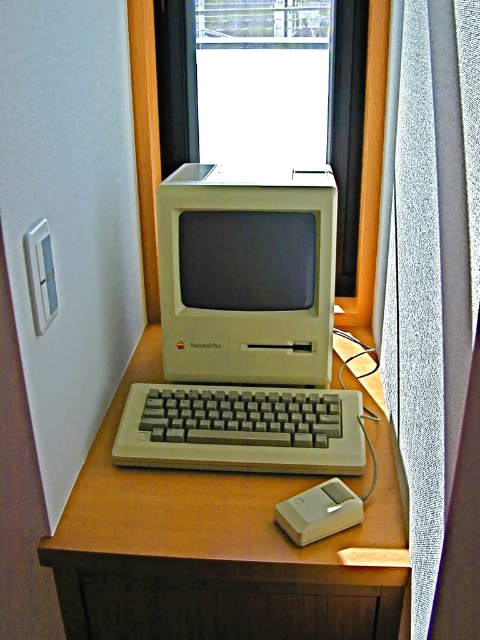
Which of these two, transparent glass window at center or white plastic computer monitor at center, stands shorter?

white plastic computer monitor at center is shorter.

Is point (311, 80) positioned behind point (259, 356)?

Yes, it is.

Is point (177, 116) more distant than point (331, 250)?

Yes.

This screenshot has height=640, width=480. Find the location of `transparent glass window at center`. transparent glass window at center is located at coordinates (267, 92).

Is wooden at center shorter than white plastic computer monitor at center?

Incorrect, wooden at center's height does not fall short of white plastic computer monitor at center's.

Between point (100, 497) and point (287, 216), which one is positioned behind?

Point (287, 216)

Between point (222, 592) and point (228, 269), which one is positioned in front?

Point (222, 592) is in front.

This screenshot has height=640, width=480. What are the coordinates of `wooden at center` in the screenshot? It's located at (216, 547).

In the scene shown: Between white plastic computer monitor at center and gray plastic keyboard at center, which one has more height?

With more height is white plastic computer monitor at center.

Which of these two, white plastic computer monitor at center or gray plastic keyboard at center, stands shorter?

gray plastic keyboard at center

What do you see at coordinates (247, 275) in the screenshot? The image size is (480, 640). I see `white plastic computer monitor at center` at bounding box center [247, 275].

Where is `white plastic computer monitor at center`? white plastic computer monitor at center is located at coordinates (247, 275).